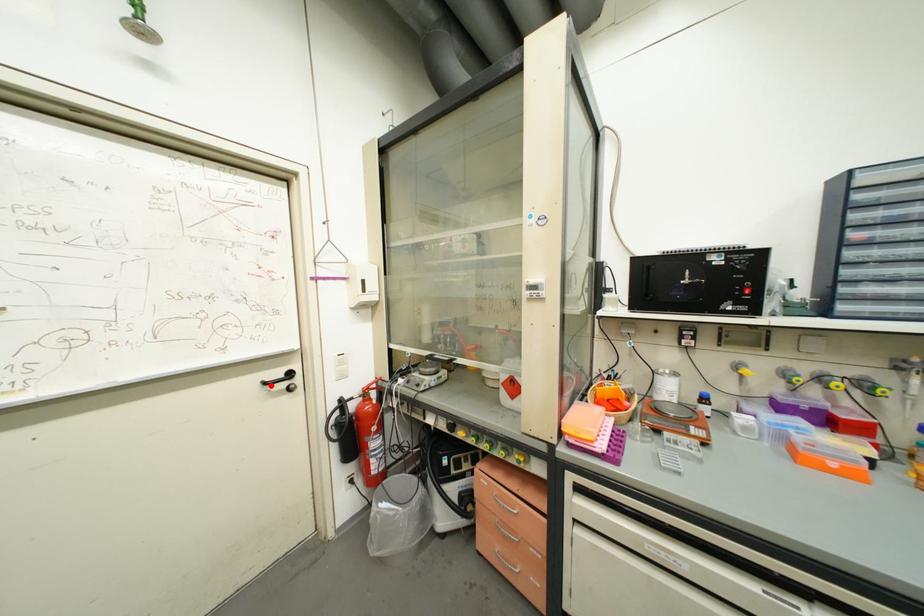
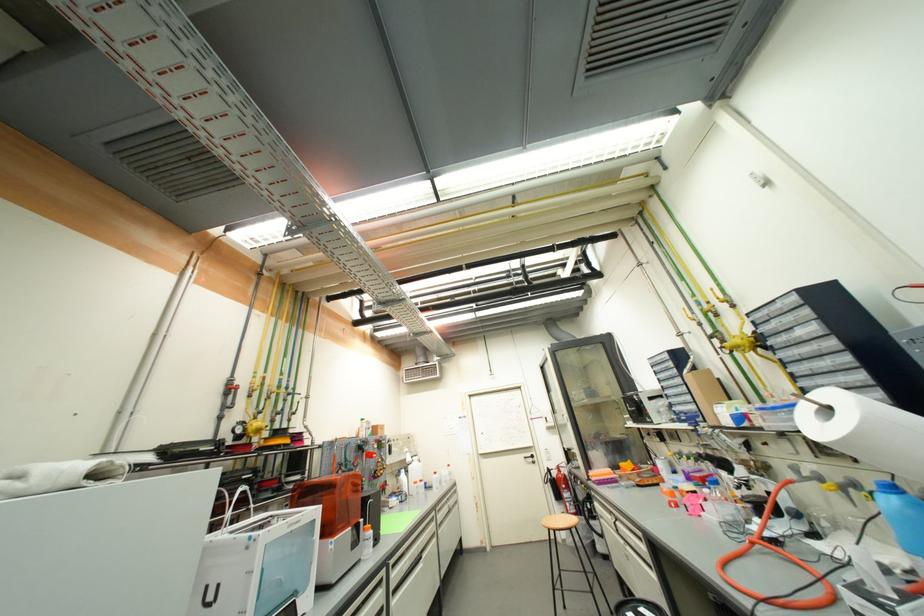
Find the pixel in the second image that matches the highlighted location in the first image.

(530, 459)